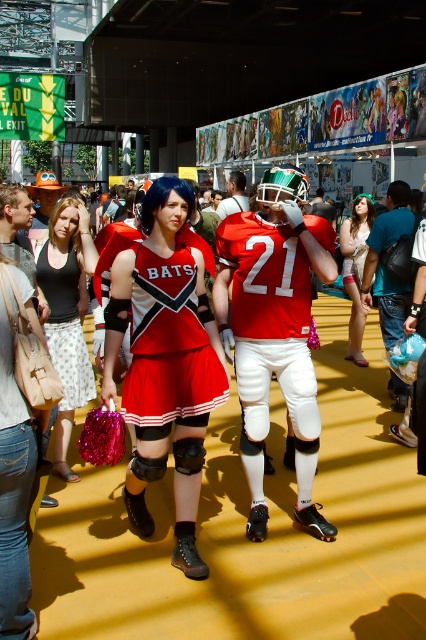
Question: Which point appears closest to the camera in this image?

Choices:
 (A) (365, 364)
 (B) (152, 403)

Answer: (B)

Question: Can you confirm if matte black tank top at center is positioned above matte white dress at center?

Choices:
 (A) no
 (B) yes

Answer: (A)

Question: Does matte red cheerleading uniform at center have a larger size compared to matte red football uniform at center?

Choices:
 (A) no
 (B) yes

Answer: (A)

Question: Which point is closer to the camera?

Choices:
 (A) (245, 241)
 (B) (189, 406)

Answer: (B)

Question: From the image, what is the correct spatial relationship of matte red football uniform at center in relation to matte black tank top at center?

Choices:
 (A) left
 (B) right

Answer: (B)

Question: Among these objects, which one is nearest to the camera?

Choices:
 (A) matte red cheerleader outfit at center
 (B) matte white dress at center
 (C) matte red cheerleading uniform at center
 (D) matte black tank top at center

Answer: (A)